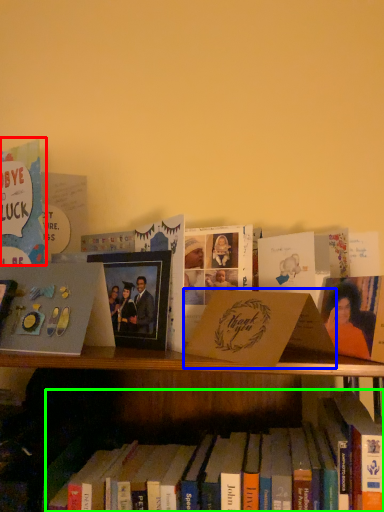
Question: Based on their relative distances, which object is farther from book (highlighted by a red box)? Choose from paperback book (highlighted by a blue box) and book (highlighted by a green box).

Choices:
 (A) paperback book
 (B) book

Answer: (B)